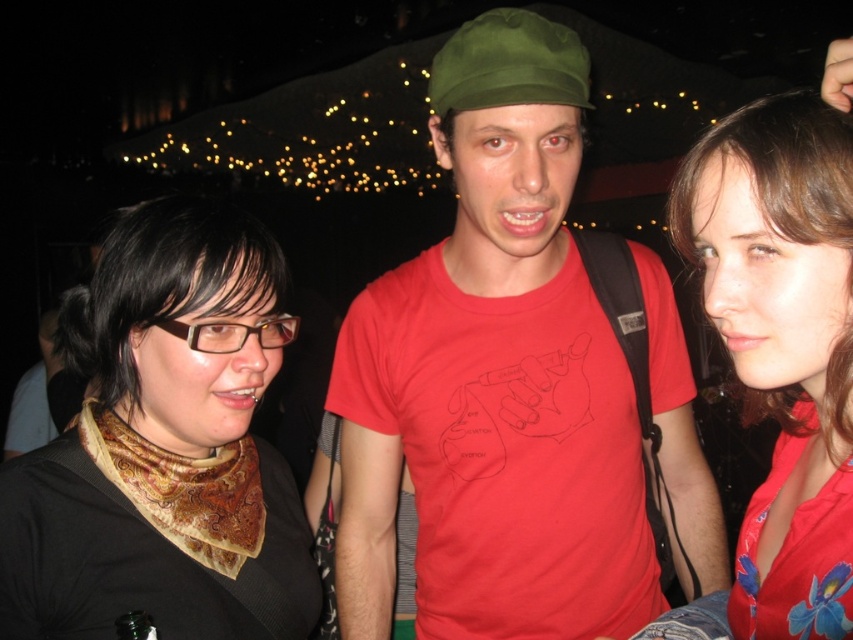
You are a photographer trying to capture a candid shot of the two people wearing the black satin scarf at left and the matte red blouse at center. Your camera has a maximum focus range of 20 inches. Can you fit both subjects within the camera frame without moving closer?

The distance between the black satin scarf at left and the matte red blouse at center is 22.29 inches, which exceeds the camera maximum focus range of 20 inches. You need to move closer to ensure both subjects are in focus.